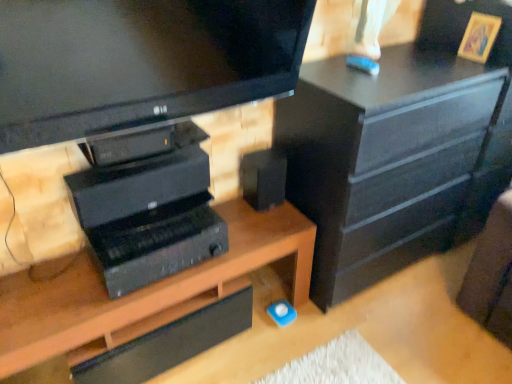
Where is `vacant area that lies in front of black matte chest of drawers at upper right`? The height and width of the screenshot is (384, 512). vacant area that lies in front of black matte chest of drawers at upper right is located at coordinates (378, 340).